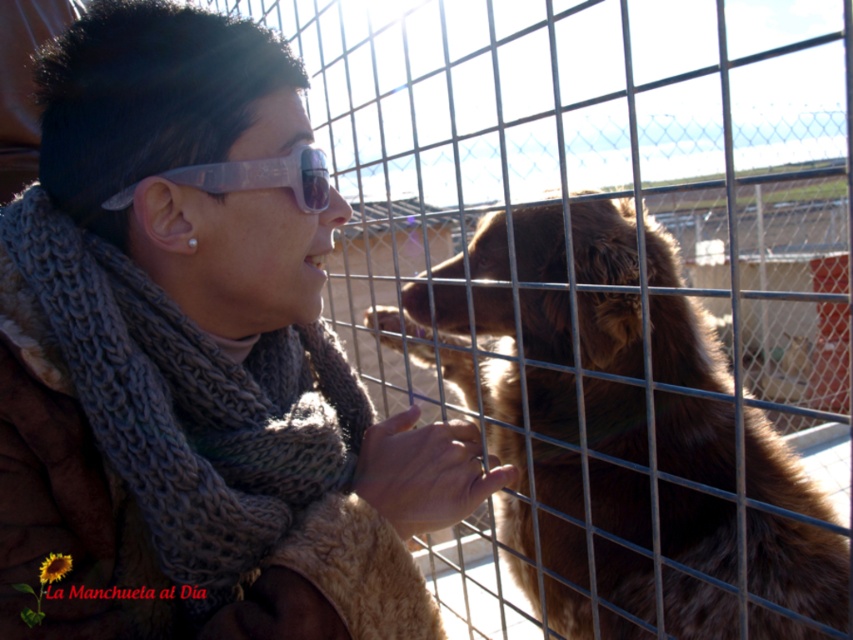
Which is behind, point (288, 513) or point (611, 243)?

Point (611, 243)

Between knitted scarf at center and brown furry dog at center, which one appears on the left side from the viewer's perspective?

knitted scarf at center

Locate an element on the screen. This screenshot has height=640, width=853. knitted scarf at center is located at coordinates (196, 360).

Is brown furry dog at center smaller than transparent plastic goggles at upper center?

Incorrect, brown furry dog at center is not smaller in size than transparent plastic goggles at upper center.

Is brown furry dog at center shorter than transparent plastic goggles at upper center?

In fact, brown furry dog at center may be taller than transparent plastic goggles at upper center.

Measure the distance between point (532,300) and camera.

A distance of 4.84 feet exists between point (532,300) and camera.

This screenshot has width=853, height=640. I want to click on brown furry dog at center, so click(624, 436).

Is knitted scarf at center shorter than transparent plastic goggles at upper center?

No.

Is knitted scarf at center behind transparent plastic goggles at upper center?

No, knitted scarf at center is in front of transparent plastic goggles at upper center.

Is point (241, 205) positioned before point (328, 196)?

That is True.

Find the location of `knitted scarf at center`. knitted scarf at center is located at coordinates (196, 360).